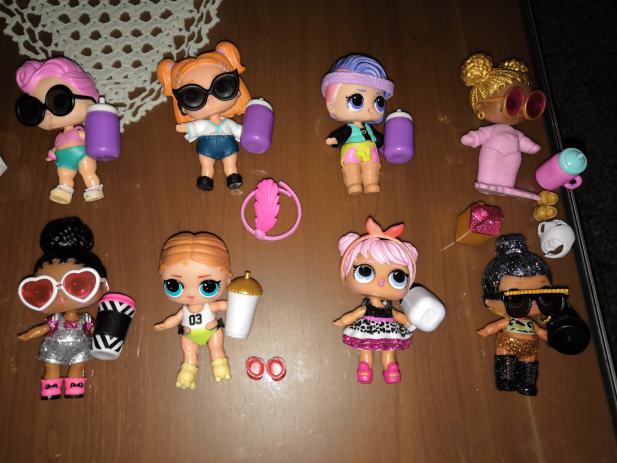
Find the location of a particular element. The image size is (617, 463). lol baby toy is located at coordinates (515, 318), (374, 291), (193, 281), (62, 308), (67, 151), (216, 134), (354, 143), (516, 150).